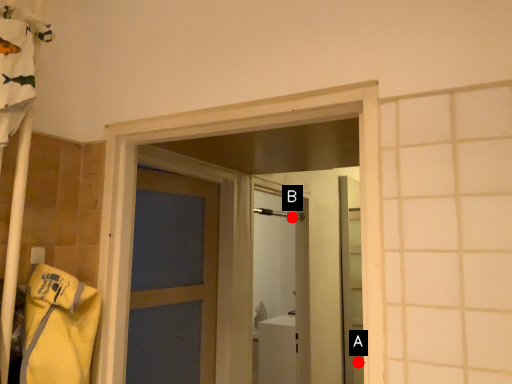
Question: Two points are circled on the image, labeled by A and B beside each circle. Which point appears closest to the camera in this image?

Choices:
 (A) A is closer
 (B) B is closer

Answer: (B)